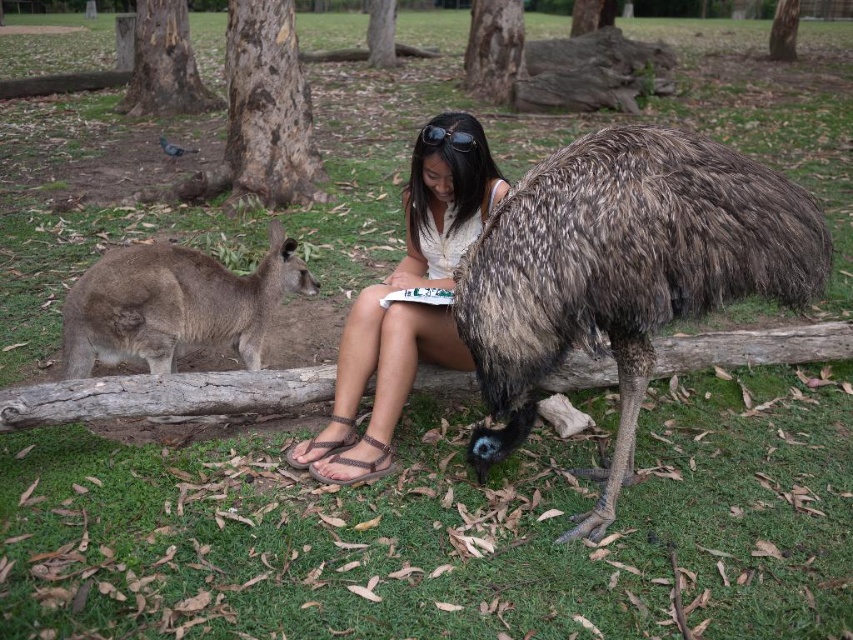
You are a park ranger who needs to ensure the safety of both animals and visitors. According to the image, how far apart are the brown speckled feathers at center and the brown furry kangaroo at left?

The brown speckled feathers at center are 5.76 feet away from the brown furry kangaroo at left.

You are a photographer trying to capture the woman feeding the animals. You notice the white fabric shirt at center and the black textured sunglasses at upper center. Which object should you focus on first if you want to ensure both are in the frame without moving the camera?

The black textured sunglasses at upper center should be focused on first since it is above the white fabric shirt at center, allowing the photographer to frame the shot so both are included without needing to adjust the camera position.